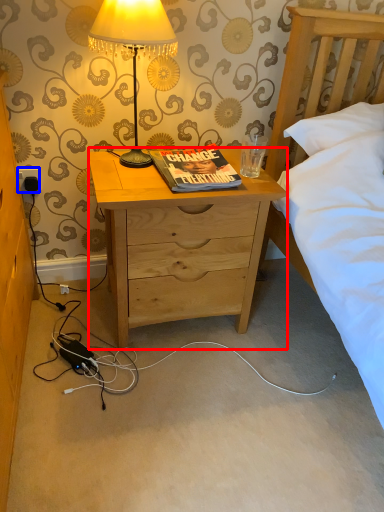
Question: Which point is closer to the camera, desk (highlighted by a red box) or power outlet (highlighted by a blue box)?

Choices:
 (A) desk
 (B) power outlet

Answer: (A)